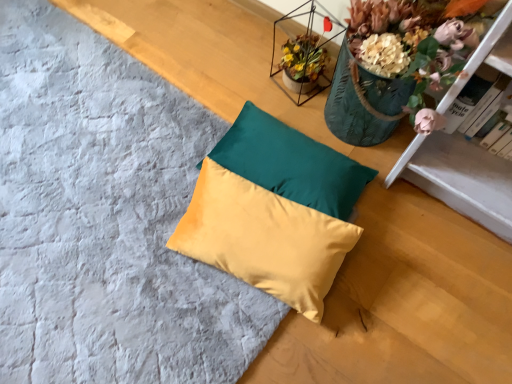
Identify the location of free spot to the left of satin yellow pillow at center, which is the 2th pillow in top-to-bottom order. This screenshot has width=512, height=384. tap(115, 251).